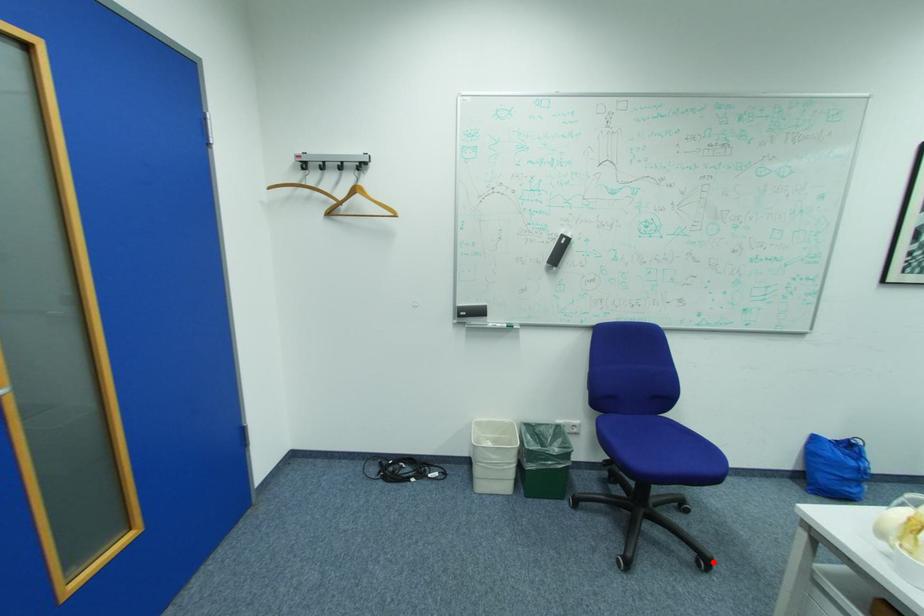
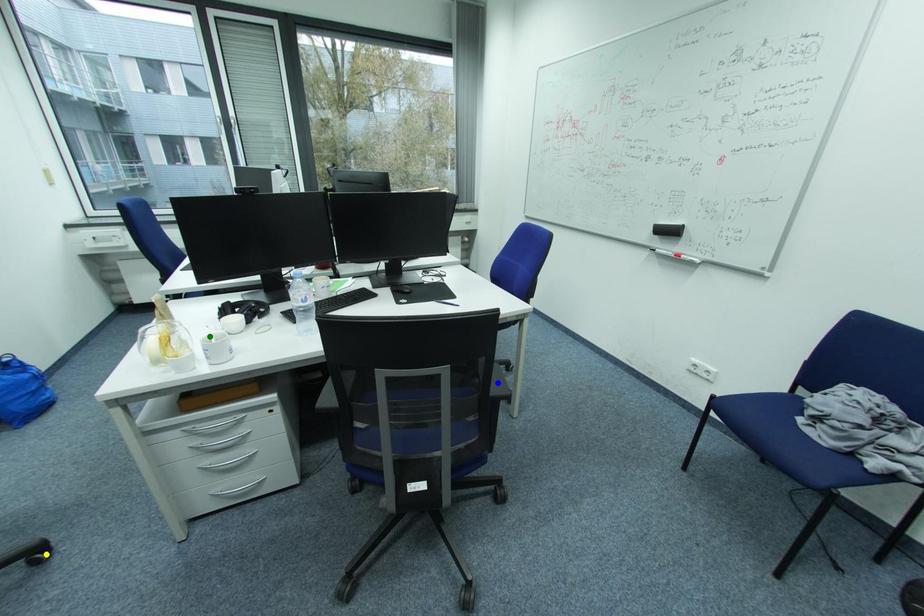
Question: I am providing you with two images of the same scene from different viewpoints. A red point is marked on the first image. You are given multiple points on the second image. Which mark in image 2 goes with the point in image 1?

Choices:
 (A) blue point
 (B) green point
 (C) yellow point

Answer: (C)